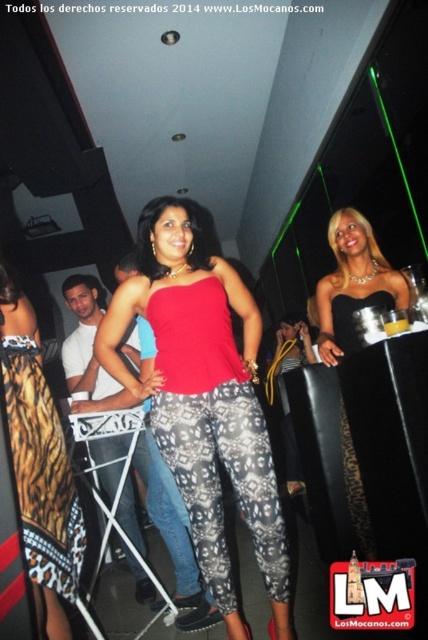
Question: Which is farther from the matte red tank top at center?

Choices:
 (A) black satin dress at center
 (B) printed fabric skirt at lower left

Answer: (A)

Question: Can you confirm if matte red tank top at center is smaller than printed fabric skirt at lower left?

Choices:
 (A) yes
 (B) no

Answer: (B)

Question: Can you confirm if printed fabric skirt at lower left is positioned below black satin dress at center?

Choices:
 (A) yes
 (B) no

Answer: (A)

Question: Which of the following is the closest to the observer?

Choices:
 (A) (199, 435)
 (B) (30, 470)
 (C) (365, 506)

Answer: (B)

Question: Which of the following is the farthest from the observer?

Choices:
 (A) (181, 416)
 (B) (29, 492)
 (C) (350, 480)

Answer: (C)

Question: Does printed fabric skirt at lower left appear on the right side of black satin dress at center?

Choices:
 (A) yes
 (B) no

Answer: (B)